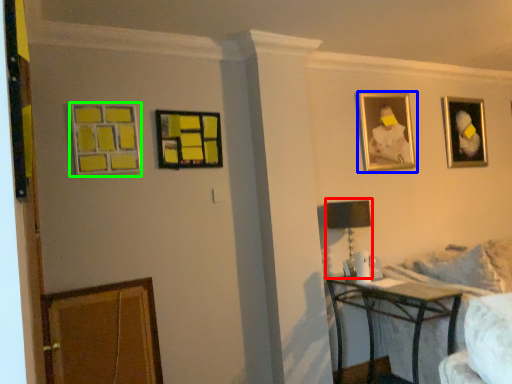
Question: Considering the real-world distances, which object is closest to table lamp (highlighted by a red box)? picture frame (highlighted by a blue box) or picture frame (highlighted by a green box).

Choices:
 (A) picture frame
 (B) picture frame

Answer: (A)